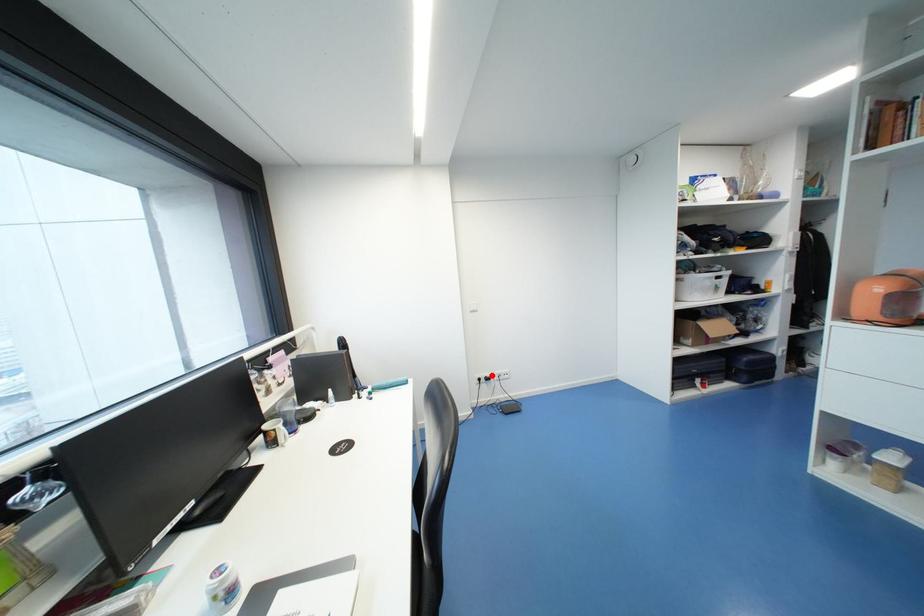
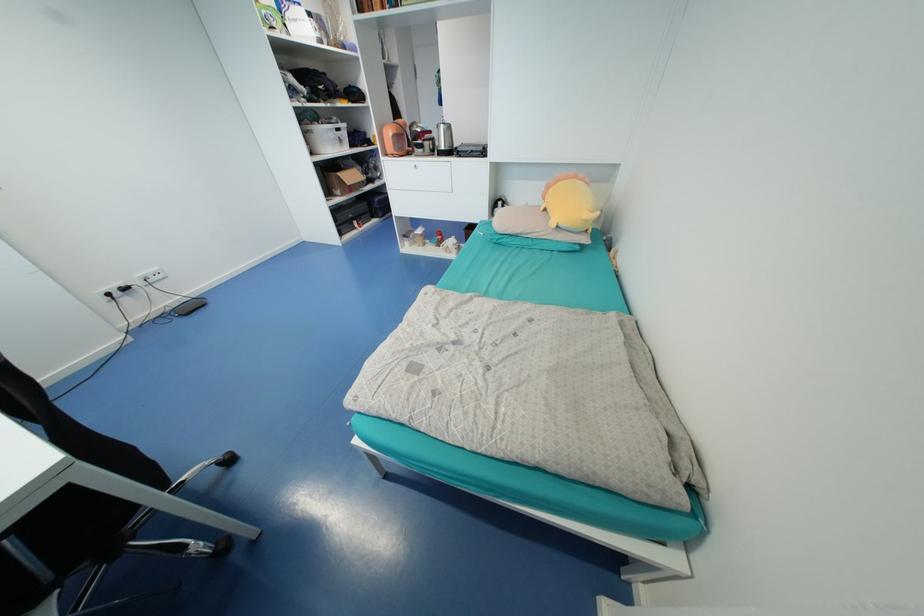
In the second image, find the point that corresponds to the highlighted location in the first image.

(125, 285)